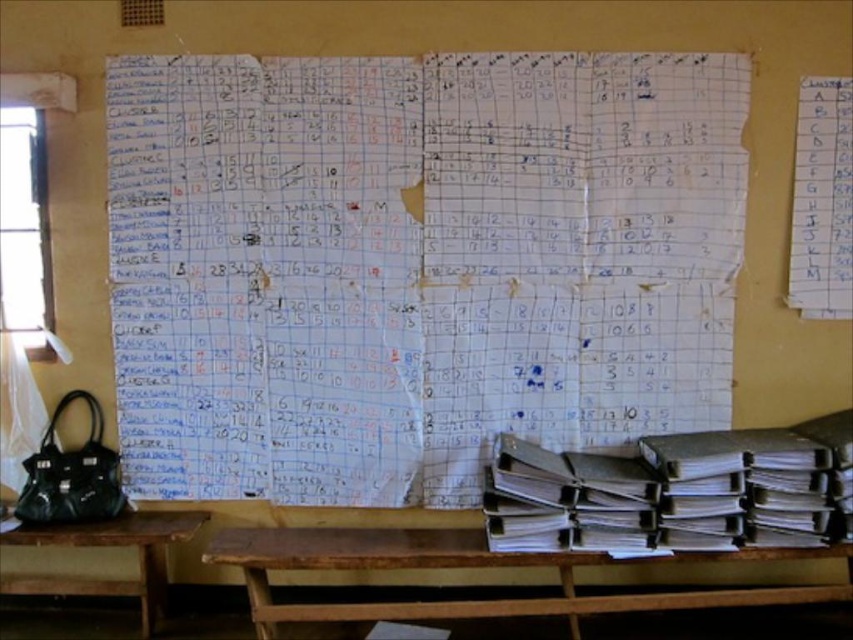
Question: Is white paper at center positioned at the back of brown wooden table at lower left?

Choices:
 (A) yes
 (B) no

Answer: (A)

Question: Which point appears farthest from the camera in this image?

Choices:
 (A) (79, 584)
 (B) (651, 561)
 (C) (693, 330)

Answer: (A)

Question: Observing the image, what is the correct spatial positioning of white paper at center in reference to brown wooden table at lower left?

Choices:
 (A) below
 (B) above

Answer: (B)

Question: Which of the following is the closest to the observer?

Choices:
 (A) (119, 593)
 (B) (291, 74)

Answer: (B)

Question: Which object is farther from the camera taking this photo?

Choices:
 (A) white paper at center
 (B) brown wooden table at lower center

Answer: (A)

Question: From the image, what is the correct spatial relationship of brown wooden table at lower center in relation to brown wooden table at lower left?

Choices:
 (A) below
 (B) above

Answer: (A)